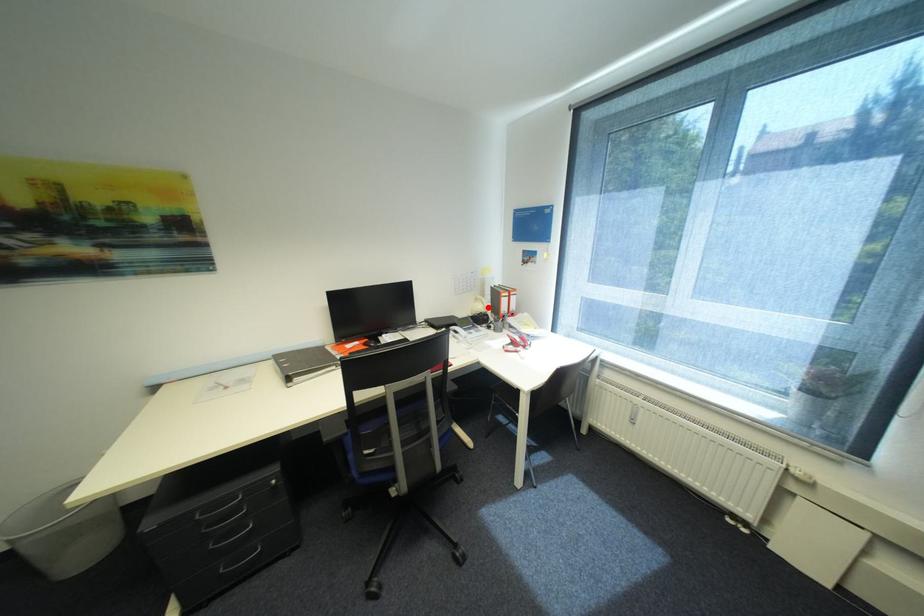
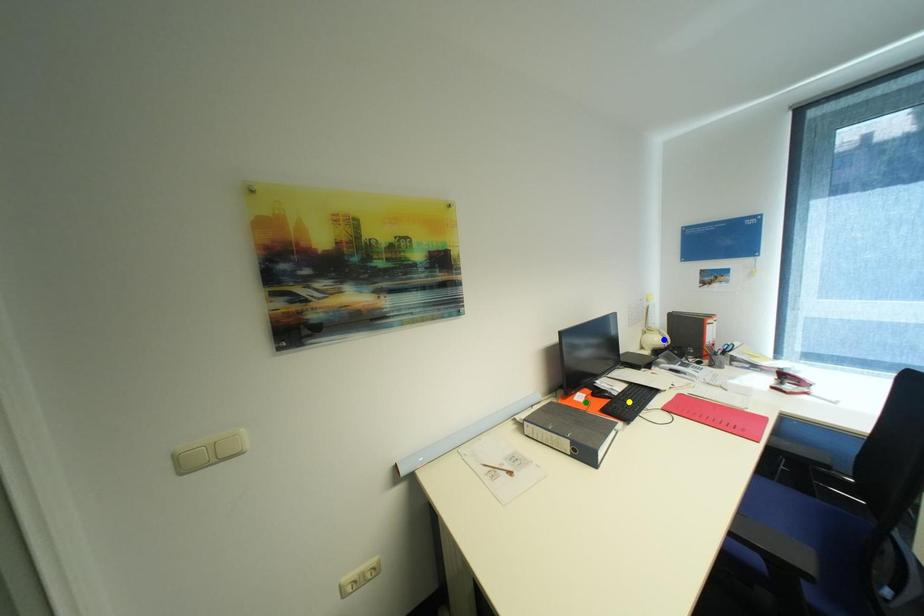
Question: I am providing you with two images of the same scene from different viewpoints. A red point is marked on the first image. You are given multiple points on the second image. Which mark in image 2 goes with the point in image 1?

Choices:
 (A) green point
 (B) blue point
 (C) yellow point

Answer: (B)